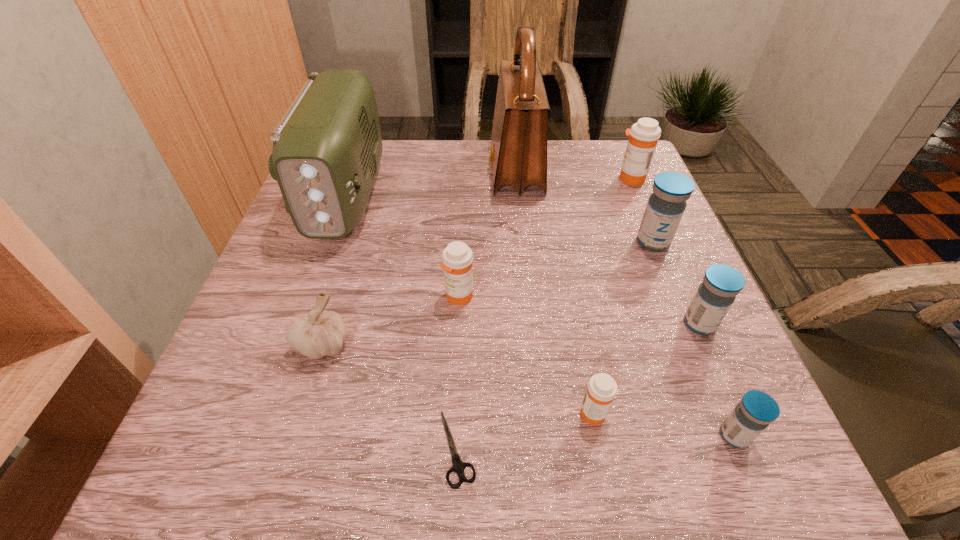
This screenshot has width=960, height=540. In order to click on vacant region located on the left of the rightmost orange medicine in this screenshot , I will do `click(591, 179)`.

You are a GUI agent. You are given a task and a screenshot of the screen. Output one action in this format:
    pyautogui.click(x=<x>, y=<y>)
    Task: Click on the vacant space positioned 0.260m on the front of the fifth nearest medicine
    This screenshot has width=960, height=540.
    Given the screenshot: What is the action you would take?
    pyautogui.click(x=702, y=361)

Find the location of a particular element. The height and width of the screenshot is (540, 960). vacant space located on the left of the second nearest orange medicine is located at coordinates (252, 296).

I want to click on free space located 0.340m on the left of the second biggest blue medicine, so click(492, 324).

Locate an element on the screen. This screenshot has width=960, height=540. free region located 0.160m on the right of the garlic is located at coordinates [x=444, y=345].

The image size is (960, 540). In order to click on free space located on the back of the fifth medicine from right to left in this screenshot , I will do `click(580, 336)`.

Where is `vacant region located on the left of the smallest blue medicine`? The width and height of the screenshot is (960, 540). vacant region located on the left of the smallest blue medicine is located at coordinates coord(602,436).

Identify the location of vacant space located on the right of the black shears. This screenshot has height=540, width=960. (715, 448).

At what (x,y) coordinates should I click in order to perform the action: click on shoulder bag located at the far edge. Please return your answer as a coordinate pair (x, y). Looking at the image, I should click on (518, 157).

At what (x,y) coordinates should I click in order to perform the action: click on radio_receiver that is at the far edge. Please return your answer as a coordinate pair (x, y). Looking at the image, I should click on (327, 147).